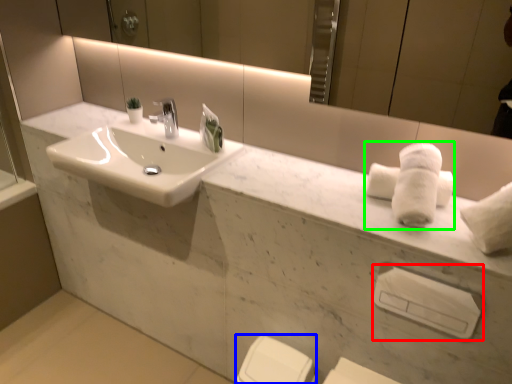
Question: Considering the real-world distances, which object is closest to towel bar (highlighted by a red box)? porcelain (highlighted by a blue box) or bath towel (highlighted by a green box).

Choices:
 (A) porcelain
 (B) bath towel

Answer: (B)